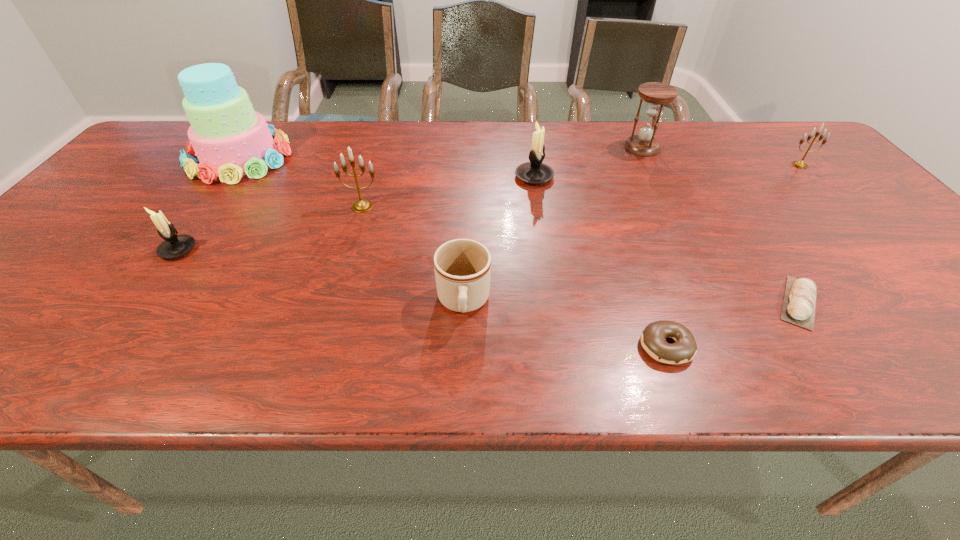
This screenshot has height=540, width=960. Find the location of `object that is positioned at the right edge`. object that is positioned at the right edge is located at coordinates (799, 164).

This screenshot has width=960, height=540. Identify the location of object that is positioned at the far left corner. (230, 139).

The height and width of the screenshot is (540, 960). What are the coordinates of `object that is at the far right corner` in the screenshot? It's located at (799, 164).

Locate an element on the screen. This screenshot has width=960, height=540. vacant region at the far edge of the desktop is located at coordinates (552, 133).

At what (x,y) coordinates should I click in order to perform the action: click on vacant space at the near edge of the desktop. Please return your answer as a coordinate pair (x, y). Image resolution: width=960 pixels, height=540 pixels. Looking at the image, I should click on (799, 358).

Locate an element on the screen. Image resolution: width=960 pixels, height=540 pixels. blank area at the left edge is located at coordinates tap(121, 174).

Where is `vacant area at the far right corner of the desktop`? The image size is (960, 540). vacant area at the far right corner of the desktop is located at coordinates (757, 122).

Find the location of a particular element. The image size is (960, 540). free space between the second candelabrum from right to left and the doughnut is located at coordinates (600, 261).

Identify the location of vacant space in between the second object from right to left and the right gold candelabrum. The height and width of the screenshot is (540, 960). (800, 234).

This screenshot has width=960, height=540. Find the location of `vacant area that lies between the rightmost candelabrum and the blue cake`. vacant area that lies between the rightmost candelabrum and the blue cake is located at coordinates pyautogui.click(x=519, y=161).